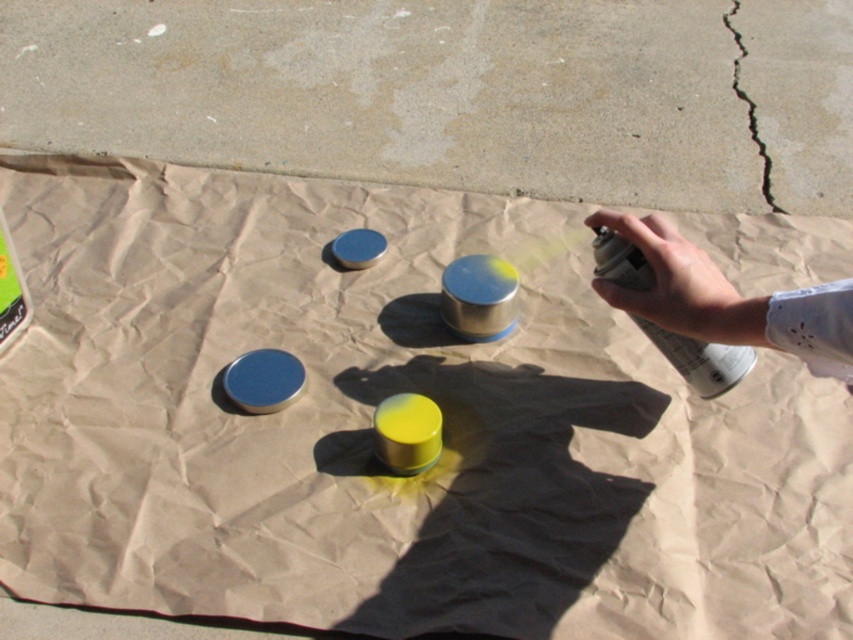
From the picture: You are an artist working on a project and need to place a new object between the metallic spray can at right and the cracked concrete at upper right. Based on their positions, where should you place the new object?

The metallic spray can at right is located below cracked concrete at upper right, so you should place the new object between them by positioning it above the metallic spray can at right and below the cracked concrete at upper right.

You are an artist working on a project and need to know if the metallic spray can at right can fit into a storage box designed to hold items narrower than the cracked concrete at upper right. Can it fit?

The metallic spray can at right is wider than the cracked concrete at upper right, so it cannot fit into the storage box designed for items narrower than the cracked concrete at upper right.

You are a painter needing to reach the cracked concrete at upper right from the metallic spray can at right. Given that your arm can extend 24 inches, will you be able to reach it without moving the spray can?

The distance between the metallic spray can at right and cracked concrete at upper right is 24.63 inches, which is slightly longer than your arm extension of 24 inches. Therefore, you will not be able to reach the cracked concrete at upper right without moving the spray can.